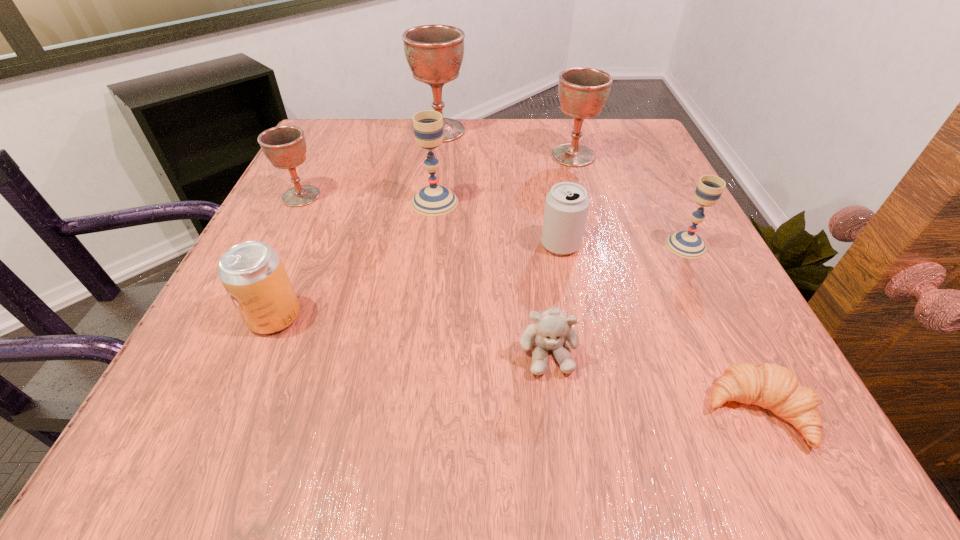
Find the location of a particular element. The image size is (960, 540). free spot between the bigger gray chalice and the teddy bear is located at coordinates (492, 276).

This screenshot has height=540, width=960. In order to click on free space between the gray teddy bear and the nearer gray chalice in this screenshot , I will do `click(617, 299)`.

Locate an element on the screen. empty space that is in between the nearest chalice and the can is located at coordinates (623, 245).

The image size is (960, 540). Find the location of `unoccupied position between the pop (soda) and the left gray chalice`. unoccupied position between the pop (soda) and the left gray chalice is located at coordinates (354, 259).

Where is `vacant space that is in between the rightmost brown chalice and the tallest chalice`? vacant space that is in between the rightmost brown chalice and the tallest chalice is located at coordinates (507, 143).

Select which object appears as the closest to the second brown chalice from right to left. Please provide its 2D coordinates. Your answer should be formatted as a tuple, i.e. [(x, y)], where the tuple contains the x and y coordinates of a point satisfying the conditions above.

[(433, 200)]

Select which object appears as the closest to the second smallest brown chalice. Please provide its 2D coordinates. Your answer should be formatted as a tuple, i.e. [(x, y)], where the tuple contains the x and y coordinates of a point satisfying the conditions above.

[(434, 53)]

Locate an element on the screen. the second closest chalice to the can is located at coordinates (433, 200).

Select which chalice appears as the fourth closest to the second smallest brown chalice. Please provide its 2D coordinates. Your answer should be formatted as a tuple, i.e. [(x, y)], where the tuple contains the x and y coordinates of a point satisfying the conditions above.

[(284, 146)]

I want to click on the closest brown chalice to the eighth tallest object, so [x=583, y=91].